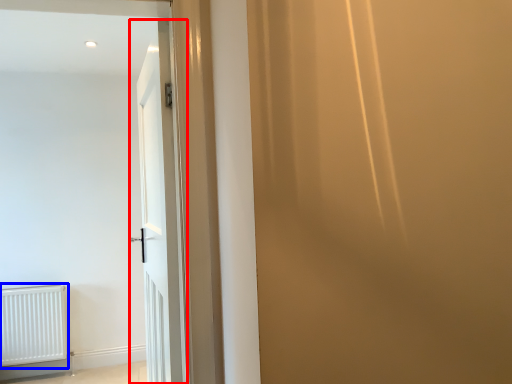
Question: Which object appears closest to the camera in this image, door (highlighted by a red box) or radiator (highlighted by a blue box)?

Choices:
 (A) door
 (B) radiator

Answer: (A)